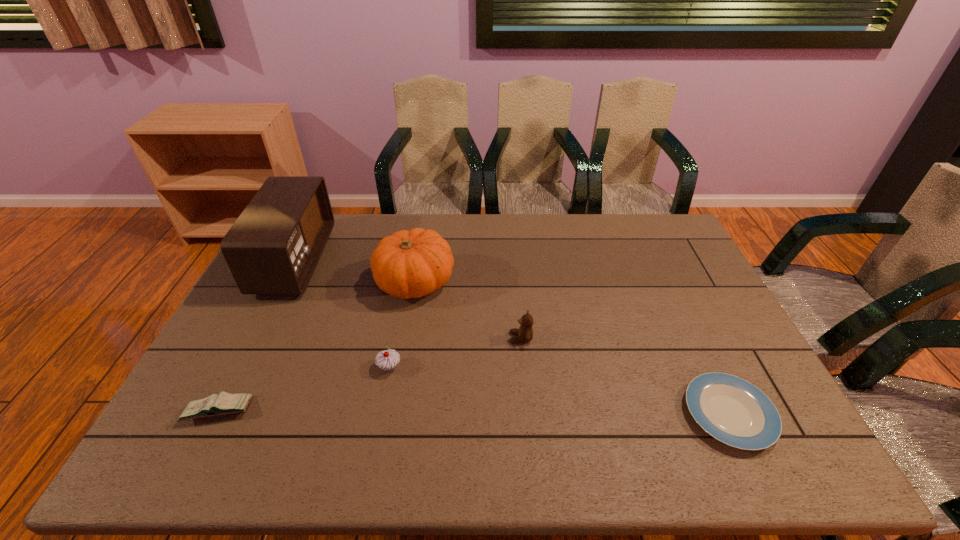
I want to click on free spot that satisfies the following two spatial constraints: 1. on the front-facing side of the rightmost object; 2. on the left side of the tallest object, so click(x=218, y=414).

You are a GUI agent. You are given a task and a screenshot of the screen. Output one action in this format:
    pyautogui.click(x=<x>, y=<y>)
    Task: Click on the free space that satisfies the following two spatial constraints: 1. on the front-facing side of the radio receiver; 2. on the left side of the shortest object
    This screenshot has width=960, height=540.
    Given the screenshot: What is the action you would take?
    pyautogui.click(x=218, y=414)

You are a GUI agent. You are given a task and a screenshot of the screen. Output one action in this format:
    pyautogui.click(x=<x>, y=<y>)
    Task: Click on the vacant area that satisfies the following two spatial constraints: 1. at the face of the third farthest object; 2. on the right side of the plate
    The width and height of the screenshot is (960, 540).
    Given the screenshot: What is the action you would take?
    [x=528, y=414]

This screenshot has width=960, height=540. In order to click on free space that satisfies the following two spatial constraints: 1. at the face of the teddy bear; 2. on the right side of the shortest object in this screenshot , I will do `click(528, 414)`.